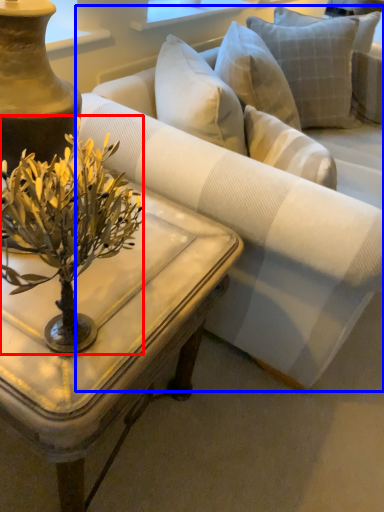
Question: Which object is closer to the camera taking this photo, flower (highlighted by a red box) or studio couch (highlighted by a blue box)?

Choices:
 (A) flower
 (B) studio couch

Answer: (A)